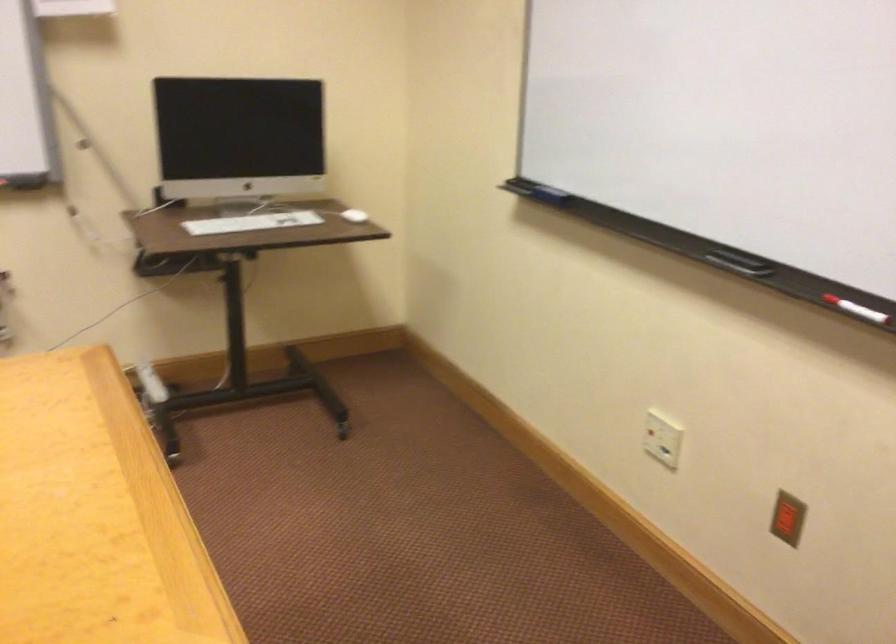
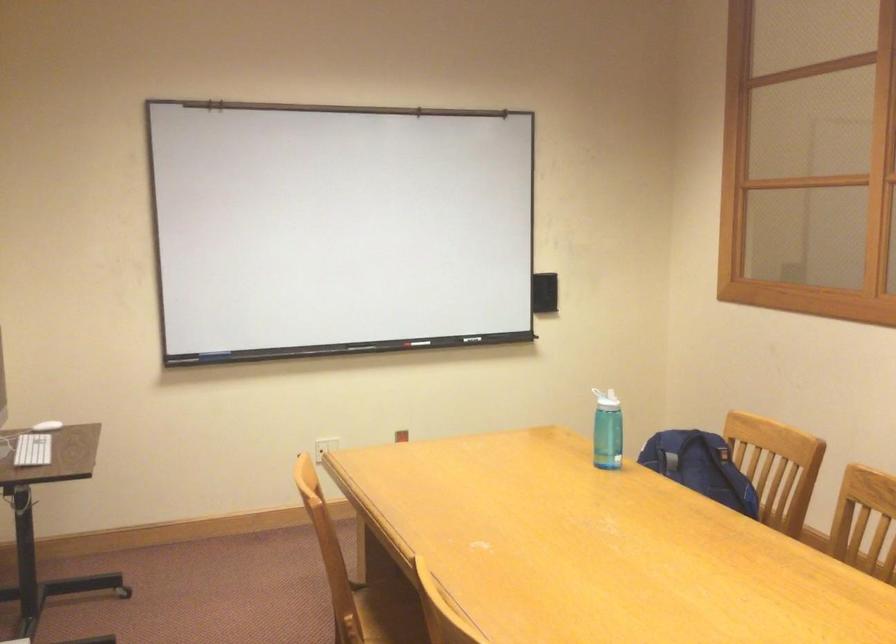
Where in the second image is the point corresponding to [350,214] from the first image?

(47, 426)